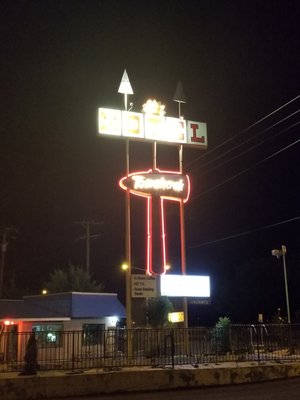
Identify the location of door. (11, 326).